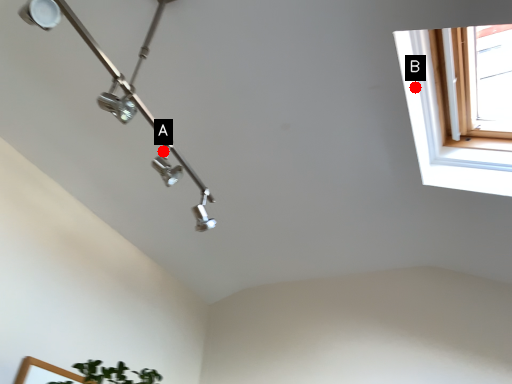
Question: Two points are circled on the image, labeled by A and B beside each circle. Which point is farther to the camera?

Choices:
 (A) A is further
 (B) B is further

Answer: (A)